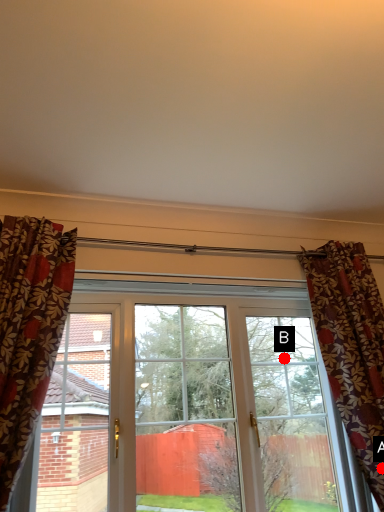
Question: Two points are circled on the image, labeled by A and B beside each circle. Which point appears closest to the camera in this image?

Choices:
 (A) A is closer
 (B) B is closer

Answer: (A)